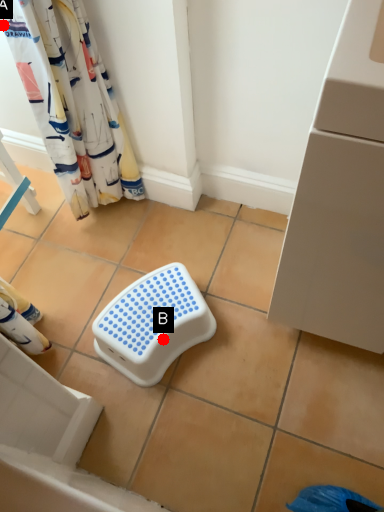
Question: Two points are circled on the image, labeled by A and B beside each circle. Which point is closer to the camera?

Choices:
 (A) A is closer
 (B) B is closer

Answer: (A)